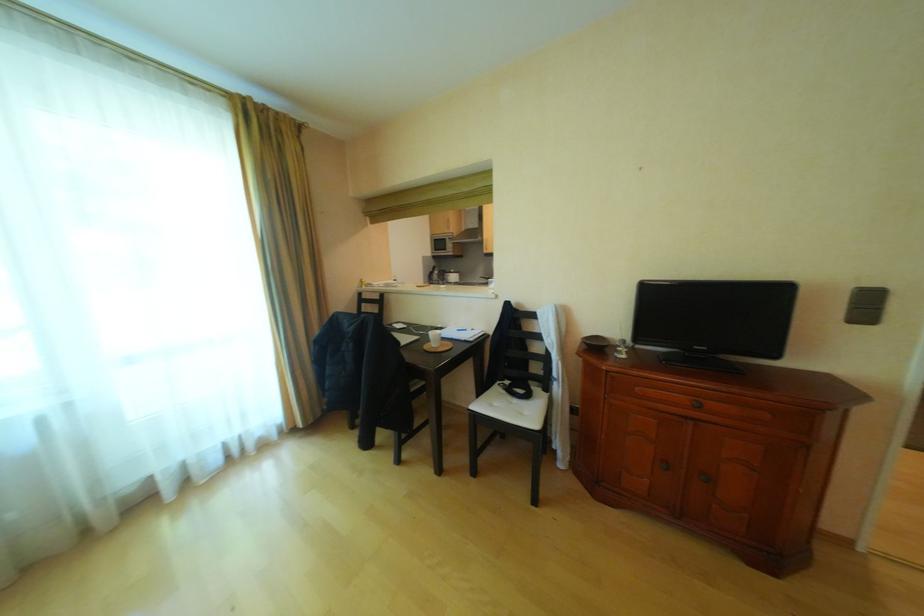
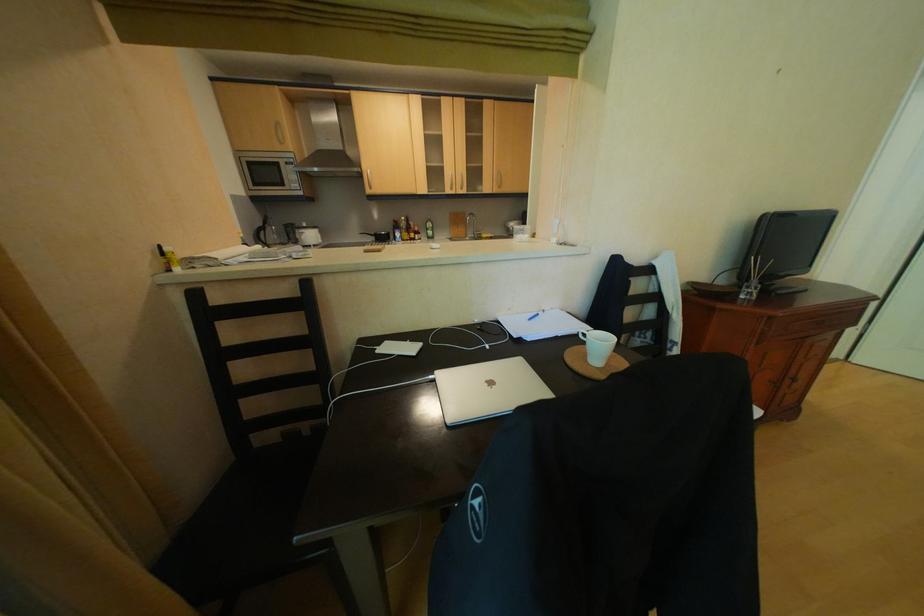
Where in the second image is the point corresponding to (464,238) from the first image?

(304, 161)